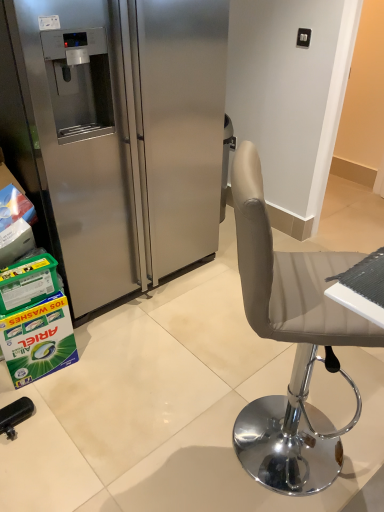
Question: In the image, is stainless steel refrigerator at left positioned in front of or behind green plastic container at lower left, the first box positioned from the top?

Choices:
 (A) behind
 (B) front

Answer: (B)

Question: From the image's perspective, is stainless steel refrigerator at left located above or below green plastic container at lower left, the first box positioned from the top?

Choices:
 (A) above
 (B) below

Answer: (A)

Question: Based on their relative distances, which object is farther from the stainless steel refrigerator at left?

Choices:
 (A) green plastic container at lower left, the second box in the bottom-to-top sequence
 (B) green cardboard box at lower left, the first box when ordered from bottom to top

Answer: (A)

Question: Which is nearer to the green cardboard box at lower left, the first box when ordered from bottom to top?

Choices:
 (A) green plastic container at lower left, the first box positioned from the top
 (B) stainless steel refrigerator at left

Answer: (A)